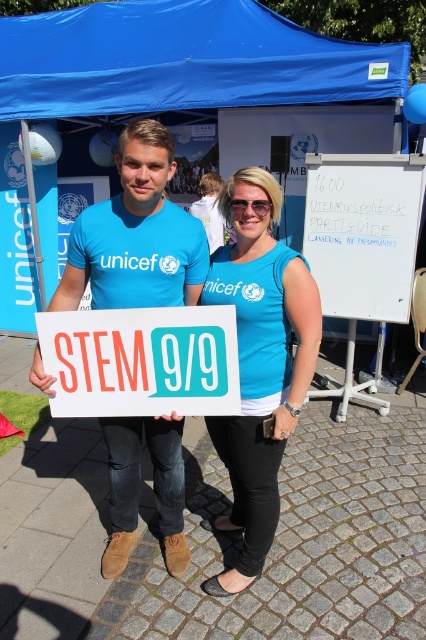
You are a photographer standing in front of the scene. You notice two points marked in the image at coordinates point (328, 74) and point (92, 99). If you want to focus on the closer point to take a clear photo, which coordinate should you choose?

Point (328, 74) is closer to the camera than point (92, 99), so you should focus on point (328, 74) to take a clear photo.

You are a visitor at this event and want to take a photo under the blue fabric canopy at upper center. If your camera can focus up to 3 meters, will you need to step closer to take a clear photo?

The blue fabric canopy at upper center is 3.68 meters away from the viewer. Since the camera can only focus up to 3 meters, you need to step closer to ensure the photo is in focus.

You are a photographer trying to capture a clear photo of the blue fabric tent at upper center and the blue fabric canopy at upper center. Which one will appear closer to the camera in the final photo?

The blue fabric tent at upper center will appear closer to the camera because it is in front of the blue fabric canopy at upper center, which is positioned behind it.